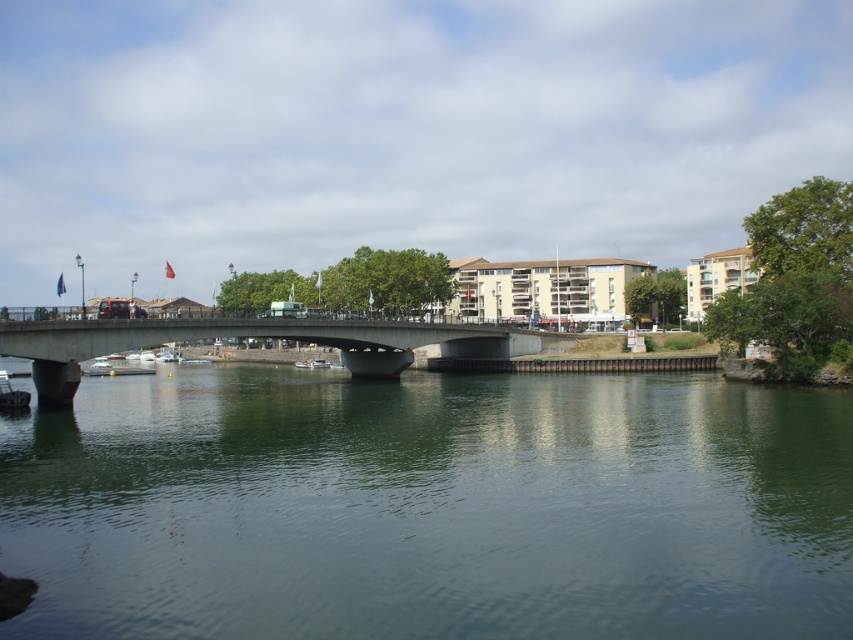
Question: Among these points, which one is nearest to the camera?

Choices:
 (A) (334, 333)
 (B) (166, 516)

Answer: (B)

Question: Does green smooth water at center appear over concrete bridge at center?

Choices:
 (A) yes
 (B) no

Answer: (B)

Question: Can you confirm if green smooth water at center is thinner than concrete bridge at center?

Choices:
 (A) no
 (B) yes

Answer: (A)

Question: Can you confirm if green smooth water at center is positioned to the left of concrete bridge at center?

Choices:
 (A) no
 (B) yes

Answer: (A)

Question: Among these points, which one is nearest to the camera?

Choices:
 (A) (405, 356)
 (B) (131, 456)

Answer: (B)

Question: Which point is farther to the camera?

Choices:
 (A) (262, 336)
 (B) (355, 576)

Answer: (A)